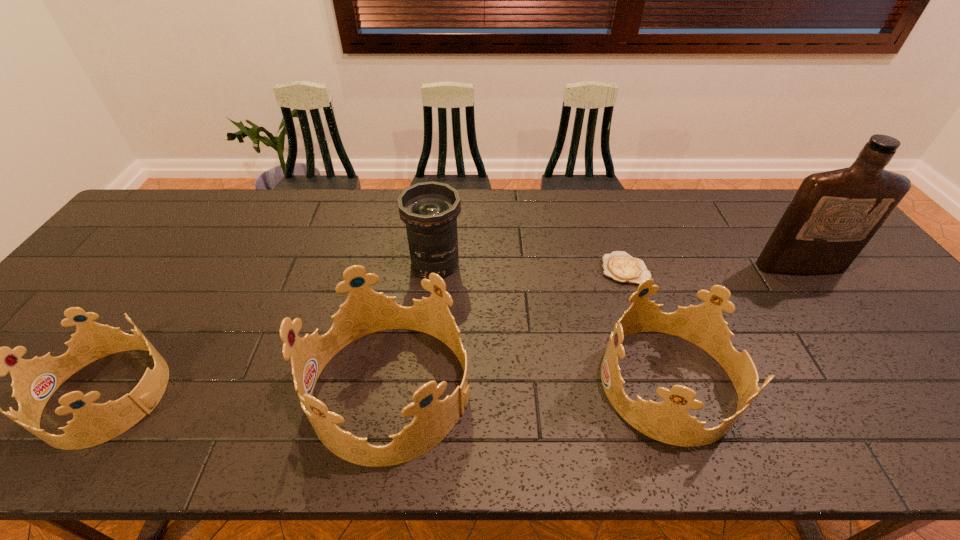
I want to click on object that is at the near left corner, so click(34, 381).

Image resolution: width=960 pixels, height=540 pixels. In order to click on vacant space at the far edge of the desktop in this screenshot , I will do `click(298, 215)`.

At what (x,y) coordinates should I click in order to perform the action: click on vacant region at the near edge of the desktop. Please return your answer as a coordinate pair (x, y). The height and width of the screenshot is (540, 960). Looking at the image, I should click on point(665,374).

Where is `free space at the left edge of the desktop`? This screenshot has height=540, width=960. free space at the left edge of the desktop is located at coordinates (78, 282).

You are a GUI agent. You are given a task and a screenshot of the screen. Output one action in this format:
    pyautogui.click(x=<x>, y=<y>)
    Task: Click on the vacant region at the right edge of the desktop
    The height and width of the screenshot is (540, 960).
    Given the screenshot: What is the action you would take?
    pyautogui.click(x=893, y=332)

In order to click on free space that is in between the second tiara from right to left and the second shortest tiara in this screenshot , I will do `click(530, 386)`.

Locate an element on the screen. The width and height of the screenshot is (960, 540). vacant region between the telephoto lens and the rightmost tiara is located at coordinates (552, 323).

This screenshot has width=960, height=540. What are the coordinates of `empty space that is in between the leftmost object and the second tiara from right to left` in the screenshot? It's located at (250, 392).

Find the location of a particular element. The image size is (960, 540). free spot between the tallest object and the second tiara from left to right is located at coordinates (596, 328).

You are a GUI agent. You are given a task and a screenshot of the screen. Output one action in this format:
    pyautogui.click(x=<x>, y=<y>)
    Task: Click on the free spot between the second shortest tiara and the telephoto lens
    
    Given the screenshot: What is the action you would take?
    pyautogui.click(x=552, y=323)